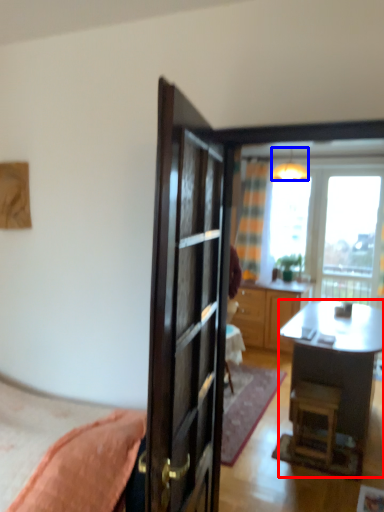
Question: Which point is further to the camera, desk (highlighted by a red box) or lamp (highlighted by a blue box)?

Choices:
 (A) desk
 (B) lamp

Answer: (B)